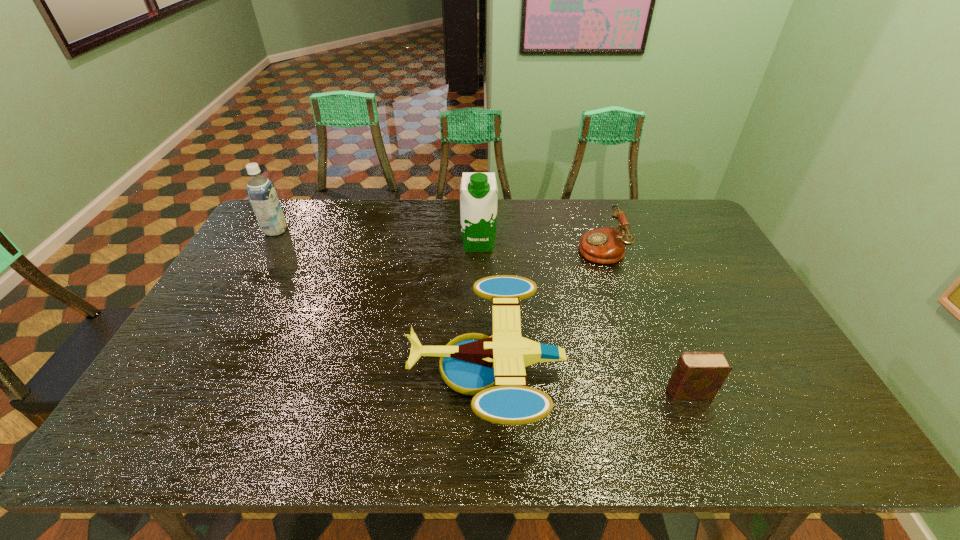
In the image, there is a desktop. Where is `vacant space at the far edge`? Image resolution: width=960 pixels, height=540 pixels. vacant space at the far edge is located at coordinates (497, 202).

Find the location of a particular element. The image size is (960, 540). free space at the near edge is located at coordinates (371, 446).

This screenshot has height=540, width=960. I want to click on free space at the left edge, so click(x=271, y=248).

Where is `vacant space at the right edge`? Image resolution: width=960 pixels, height=540 pixels. vacant space at the right edge is located at coordinates (774, 339).

This screenshot has width=960, height=540. I want to click on vacant space at the far left corner, so click(289, 214).

Where is `free location at the far right corner`? The width and height of the screenshot is (960, 540). free location at the far right corner is located at coordinates (686, 204).

Identify the location of empty location between the drone and the right soya milk. (483, 306).

Identify the location of vacant area that lies between the telephone and the left soya milk. This screenshot has height=540, width=960. (438, 239).

You are a GUI agent. You are given a task and a screenshot of the screen. Output one action in this format:
    pyautogui.click(x=<x>, y=<y>)
    Task: Click on the unoccupied area between the right soya milk and the diary
    Image resolution: width=960 pixels, height=540 pixels.
    Given the screenshot: What is the action you would take?
    pyautogui.click(x=584, y=318)

Image resolution: width=960 pixels, height=540 pixels. I want to click on empty space that is in between the telephone and the diary, so click(644, 320).